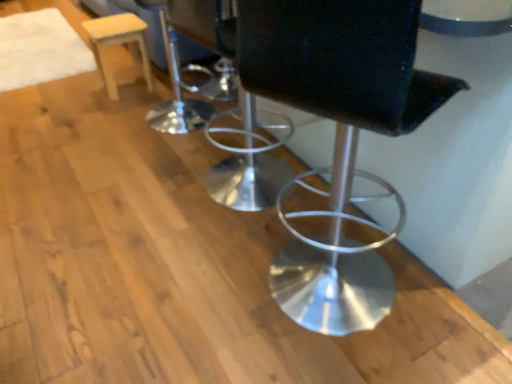
Where is `metallic silver stool at center`? metallic silver stool at center is located at coordinates (339, 136).

Describe the element at coordinates (339, 136) in the screenshot. The image size is (512, 384). I see `metallic silver stool at center` at that location.

In order to face metallic silver stool at center, should I rotate leftwards or rightwards?

To face it directly, rotate right by 11.338 degrees.

Measure the distance between point (278, 73) and camera.

The distance of point (278, 73) from camera is 33.66 inches.

What do you see at coordinates (118, 43) in the screenshot?
I see `light wood stool at upper left` at bounding box center [118, 43].

The height and width of the screenshot is (384, 512). In order to click on light wood stool at upper left in this screenshot , I will do `click(118, 43)`.

Identify the location of metallic silver stool at center. Image resolution: width=512 pixels, height=384 pixels. (339, 136).

Consider the image. Which is more to the right, light wood stool at upper left or metallic silver stool at center?

metallic silver stool at center is more to the right.

Considering the positions of objects light wood stool at upper left and metallic silver stool at center in the image provided, who is in front, light wood stool at upper left or metallic silver stool at center?

Positioned in front is metallic silver stool at center.

Considering the positions of point (93, 46) and point (424, 73), is point (93, 46) closer or farther from the camera than point (424, 73)?

Point (93, 46) is positioned farther from the camera compared to point (424, 73).

Based on the photo, from the image's perspective, who appears lower, light wood stool at upper left or metallic silver stool at center?

From the image's view, metallic silver stool at center is below.

From a real-world perspective, is light wood stool at upper left physically below metallic silver stool at center?

Yes, from a real-world perspective, light wood stool at upper left is beneath metallic silver stool at center.

Considering the sizes of objects light wood stool at upper left and metallic silver stool at center in the image provided, who is thinner, light wood stool at upper left or metallic silver stool at center?

light wood stool at upper left is thinner.

In terms of height, does light wood stool at upper left look taller or shorter compared to metallic silver stool at center?

Considering their sizes, light wood stool at upper left has less height than metallic silver stool at center.

Does light wood stool at upper left have a smaller size compared to metallic silver stool at center?

Correct, light wood stool at upper left occupies less space than metallic silver stool at center.

Is light wood stool at upper left positioned beyond the bounds of metallic silver stool at center?

Yes, light wood stool at upper left is located beyond the bounds of metallic silver stool at center.

Is light wood stool at upper left far away from metallic silver stool at center?

light wood stool at upper left is far away from metallic silver stool at center.

Does light wood stool at upper left turn towards metallic silver stool at center?

No, light wood stool at upper left is not turned towards metallic silver stool at center.

How many degrees apart are the facing directions of light wood stool at upper left and metallic silver stool at center?

176 degrees.

You are a GUI agent. You are given a task and a screenshot of the screen. Output one action in this format:
    pyautogui.click(x=<x>, y=<y>)
    Task: Click on the chair that is below the light wood stool at upper left (from the image's perspective)
    The width and height of the screenshot is (512, 384).
    Given the screenshot: What is the action you would take?
    pyautogui.click(x=339, y=136)

Between metallic silver stool at center and light wood stool at upper left, which one appears on the right side from the viewer's perspective?

Positioned to the right is metallic silver stool at center.

Which object is further away from the camera taking this photo, metallic silver stool at center or light wood stool at upper left?

light wood stool at upper left is further away from the camera.

Considering the points (404, 84) and (89, 23), which point is behind, point (404, 84) or point (89, 23)?

Positioned behind is point (89, 23).

Consider the image. From the image's perspective, is metallic silver stool at center located above or below light wood stool at upper left?

metallic silver stool at center is below light wood stool at upper left.

From a real-world perspective, does metallic silver stool at center stand above light wood stool at upper left?

Yes, from a real-world perspective, metallic silver stool at center is on top of light wood stool at upper left.

Between metallic silver stool at center and light wood stool at upper left, which one has smaller width?

light wood stool at upper left is thinner.

From their relative heights in the image, would you say metallic silver stool at center is taller or shorter than light wood stool at upper left?

Clearly, metallic silver stool at center is taller compared to light wood stool at upper left.

Is metallic silver stool at center smaller than light wood stool at upper left?

Actually, metallic silver stool at center might be larger than light wood stool at upper left.

Would you say metallic silver stool at center is inside or outside light wood stool at upper left?

metallic silver stool at center is spatially situated outside light wood stool at upper left.

Is metallic silver stool at center with light wood stool at upper left?

metallic silver stool at center and light wood stool at upper left are not in contact.

Does metallic silver stool at center turn towards light wood stool at upper left?

No.

Image resolution: width=512 pixels, height=384 pixels. What are the coordinates of `chair above the light wood stool at upper left (from a real-world perspective)` in the screenshot? It's located at (339, 136).

Where is `stool below the metallic silver stool at center (from a real-world perspective)`? This screenshot has width=512, height=384. stool below the metallic silver stool at center (from a real-world perspective) is located at coordinates (118, 43).

The height and width of the screenshot is (384, 512). I want to click on chair above the light wood stool at upper left (from a real-world perspective), so click(x=339, y=136).